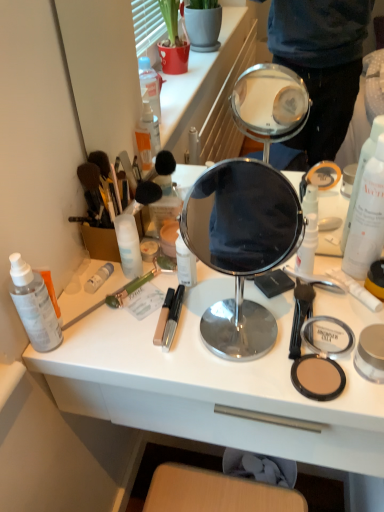
The image size is (384, 512). I want to click on free area in between translucent plastic spray bottle at left, marked as the 5th toiletry in a right-to-left arrangement, and white matte pump bottle at right, acting as the 5th toiletry starting from the left, so click(178, 302).